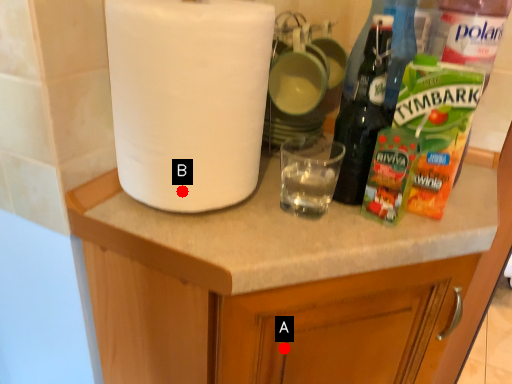
Question: Two points are circled on the image, labeled by A and B beside each circle. Among these points, which one is nearest to the camera?

Choices:
 (A) A is closer
 (B) B is closer

Answer: (B)